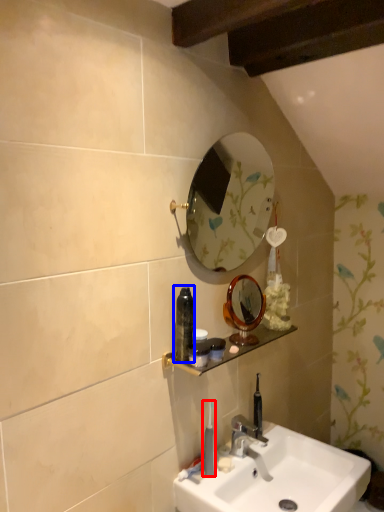
Question: Among these objects, which one is farthest to the camera, toothbrush (highlighted by a red box) or mouthwash (highlighted by a blue box)?

Choices:
 (A) toothbrush
 (B) mouthwash

Answer: (A)